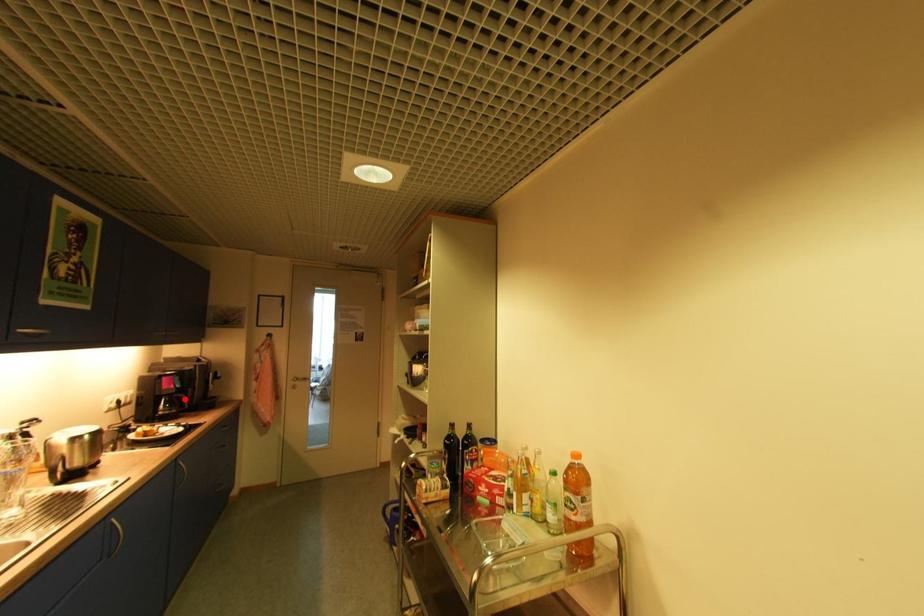
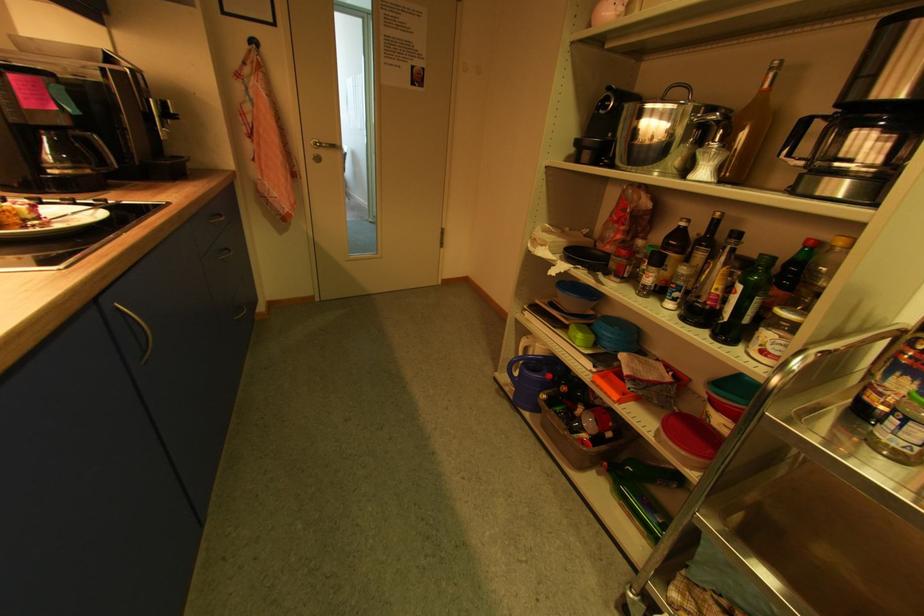
Locate, in the second image, the point that corresponds to the highlighted location in the first image.

(94, 145)